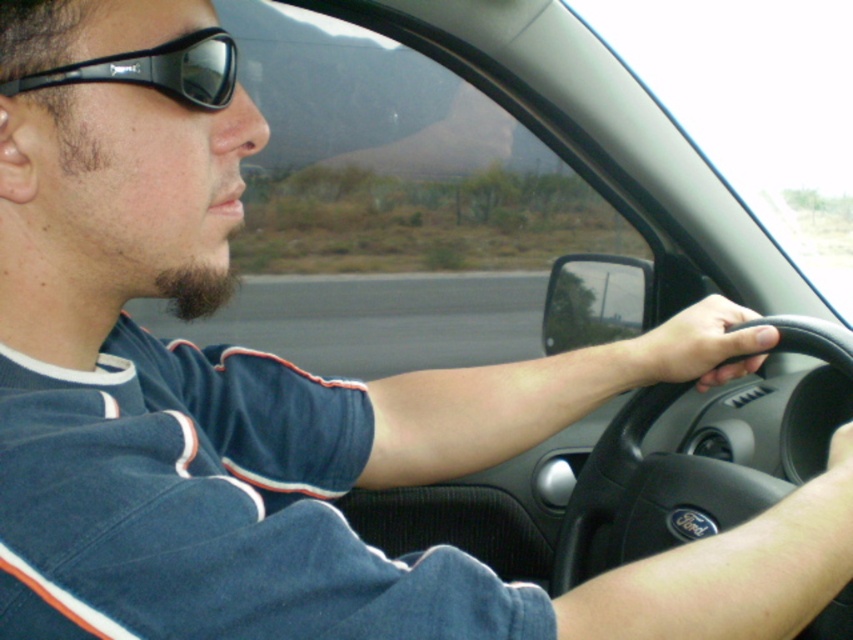
Can you confirm if black rubber steering wheel at center is thinner than black rubber sunglasses at upper left?

No.

You are a GUI agent. You are given a task and a screenshot of the screen. Output one action in this format:
    pyautogui.click(x=<x>, y=<y>)
    Task: Click on the black rubber steering wheel at center
    
    Given the screenshot: What is the action you would take?
    pyautogui.click(x=648, y=496)

I want to click on black rubber steering wheel at center, so [648, 496].